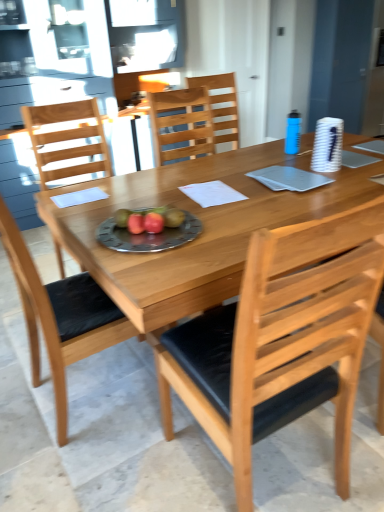
Where is `free space in front of metallic silver plate with fruits at center`? The height and width of the screenshot is (512, 384). free space in front of metallic silver plate with fruits at center is located at coordinates (158, 263).